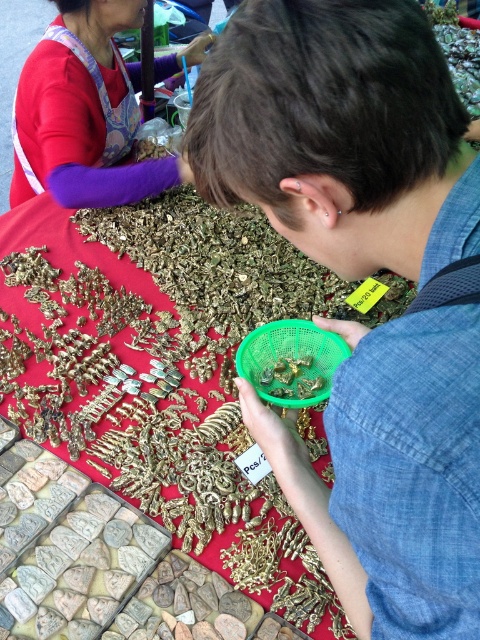
Does point (424, 140) come behind point (205, 358)?

No, it is not.

The height and width of the screenshot is (640, 480). Find the location of `green plastic basket at center`. green plastic basket at center is located at coordinates (338, 134).

The height and width of the screenshot is (640, 480). In order to click on green plastic basket at center in this screenshot , I will do `click(338, 134)`.

Can you confirm if gold metallic jewelry at center is taller than matte red shirt at upper left?

Indeed, gold metallic jewelry at center has a greater height compared to matte red shirt at upper left.

Which is behind, point (312, 420) or point (92, 3)?

The point (92, 3) is more distant.

Locate an element on the screen. gold metallic jewelry at center is located at coordinates (165, 369).

Is green plastic basket at center behind matte red shirt at upper left?

No, it is not.

Can you confirm if green plastic basket at center is positioned to the right of matte red shirt at upper left?

Yes, green plastic basket at center is to the right of matte red shirt at upper left.

Is point (356, 246) closer to viewer compared to point (20, 125)?

Yes, point (356, 246) is closer to viewer.

Image resolution: width=480 pixels, height=640 pixels. Identify the location of green plastic basket at center. (338, 134).